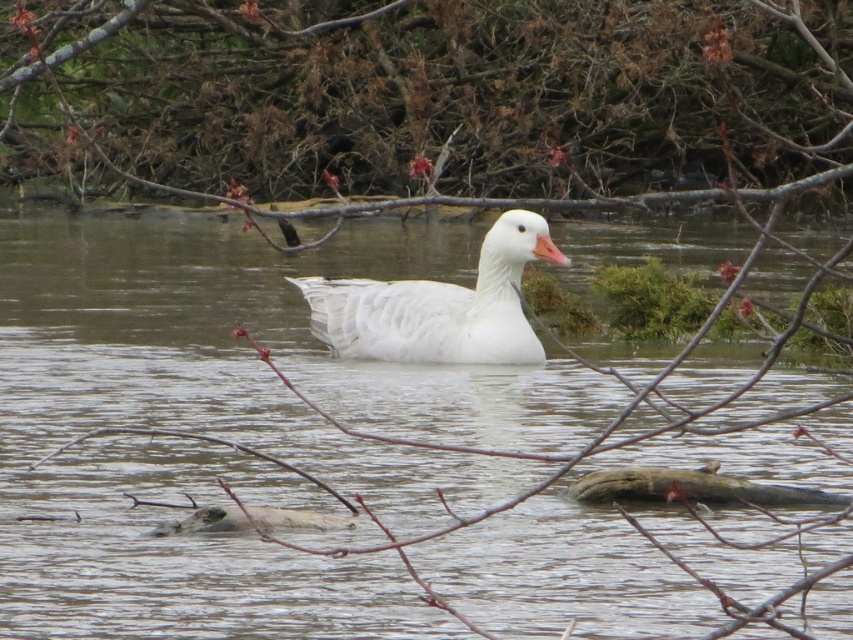
Question: In this image, where is clear water at center located relative to white matte duck at center?

Choices:
 (A) right
 (B) left

Answer: (B)

Question: Among these points, which one is nearest to the camera?

Choices:
 (A) (490, 292)
 (B) (567, 484)
 (C) (76, 420)

Answer: (B)

Question: Can you confirm if white matte duck at center is wider than brown rough log at lower center?

Choices:
 (A) yes
 (B) no

Answer: (A)

Question: Among these points, which one is farthest from the camera?

Choices:
 (A) (517, 241)
 (B) (463, 540)

Answer: (A)

Question: Does clear water at center appear over white matte duck at center?

Choices:
 (A) no
 (B) yes

Answer: (A)

Question: Which of the following is the farthest from the observer?

Choices:
 (A) white matte duck at center
 (B) brown rough log at lower center

Answer: (A)